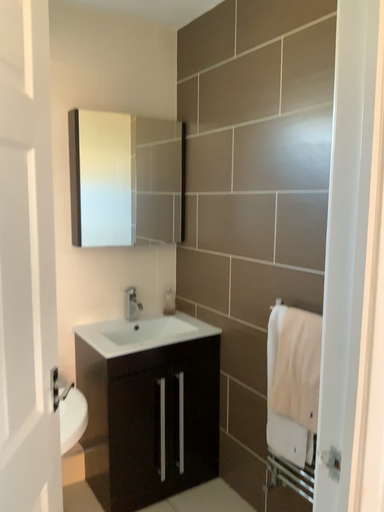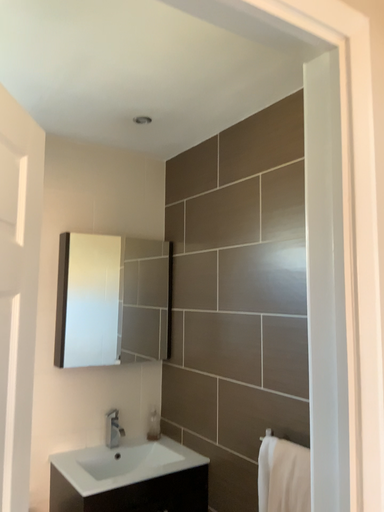
Question: How did the camera likely rotate when shooting the video?

Choices:
 (A) rotated upward
 (B) rotated downward

Answer: (A)